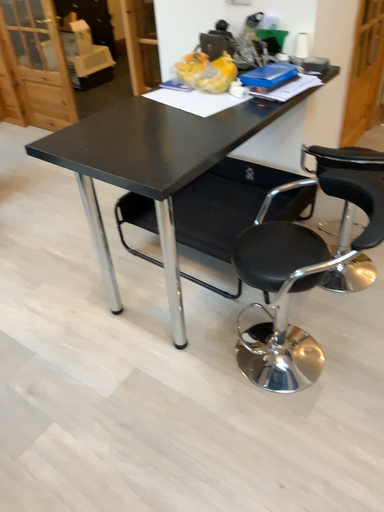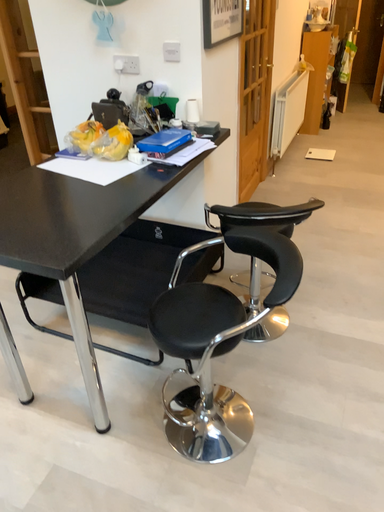
Question: Which way did the camera rotate in the video?

Choices:
 (A) rotated downward
 (B) rotated upward

Answer: (B)